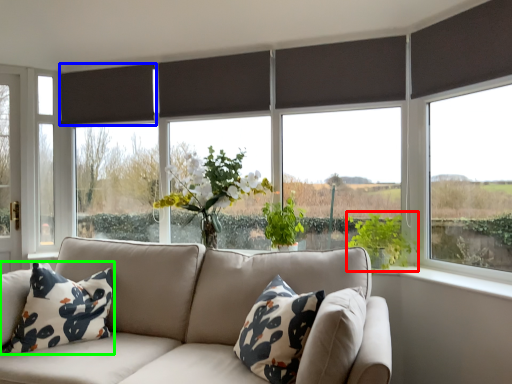
Question: Which object is the farthest from vegetation (highlighted by a red box)? Choose among these: curtain (highlighted by a blue box) or pillow (highlighted by a green box).

Choices:
 (A) curtain
 (B) pillow

Answer: (A)